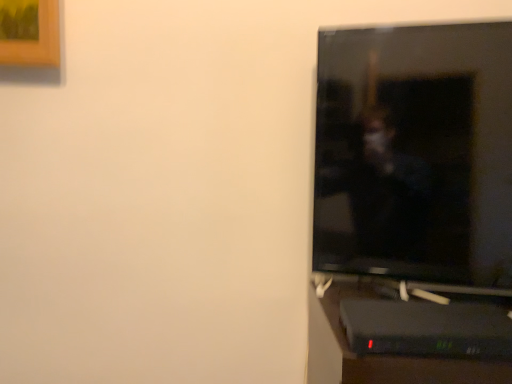
Question: Should I look upward or downward to see black plastic computer desk at lower right?

Choices:
 (A) down
 (B) up

Answer: (A)

Question: Does black plastic computer desk at lower right contain black glossy tv at right?

Choices:
 (A) no
 (B) yes

Answer: (A)

Question: Could you tell me if black plastic computer desk at lower right is facing black glossy tv at right?

Choices:
 (A) yes
 (B) no

Answer: (B)

Question: From a real-world perspective, is black plastic computer desk at lower right over black glossy tv at right?

Choices:
 (A) yes
 (B) no

Answer: (B)

Question: From the image's perspective, is black plastic computer desk at lower right on top of black glossy tv at right?

Choices:
 (A) yes
 (B) no

Answer: (B)

Question: From the image's perspective, is black plastic computer desk at lower right beneath black glossy tv at right?

Choices:
 (A) no
 (B) yes

Answer: (B)

Question: Does black plastic computer desk at lower right have a lesser height compared to black glossy tv at right?

Choices:
 (A) no
 (B) yes

Answer: (B)

Question: Is black glossy tv at right far away from black plastic computer desk at lower right?

Choices:
 (A) no
 (B) yes

Answer: (A)

Question: Could you tell me if black glossy tv at right is turned towards black plastic computer desk at lower right?

Choices:
 (A) yes
 (B) no

Answer: (A)

Question: Can you confirm if black glossy tv at right is taller than black plastic computer desk at lower right?

Choices:
 (A) yes
 (B) no

Answer: (A)

Question: Considering the relative sizes of black glossy tv at right and black plastic computer desk at lower right in the image provided, is black glossy tv at right thinner than black plastic computer desk at lower right?

Choices:
 (A) yes
 (B) no

Answer: (A)

Question: Is black glossy tv at right to the left of black plastic computer desk at lower right from the viewer's perspective?

Choices:
 (A) no
 (B) yes

Answer: (A)

Question: Is black glossy tv at right not inside black plastic computer desk at lower right?

Choices:
 (A) no
 (B) yes

Answer: (B)

Question: Is point (375, 119) closer or farther from the camera than point (466, 319)?

Choices:
 (A) farther
 (B) closer

Answer: (A)